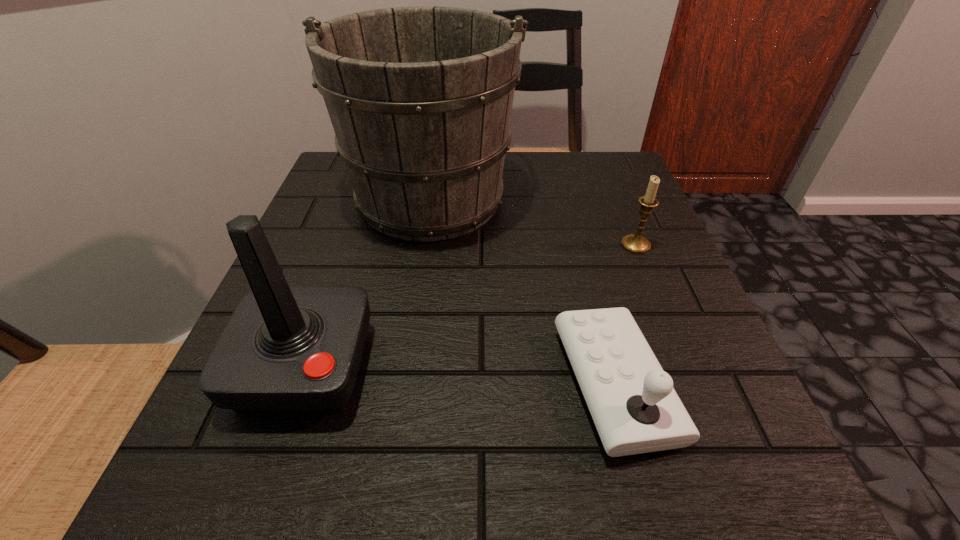
Where is `object that is at the far edge`? Image resolution: width=960 pixels, height=540 pixels. object that is at the far edge is located at coordinates [420, 98].

Where is `object present at the near edge`? object present at the near edge is located at coordinates click(x=631, y=399).

This screenshot has width=960, height=540. What are the coordinates of `bucket that is at the left edge` in the screenshot? It's located at (420, 98).

The image size is (960, 540). Identify the location of joystick positioned at the left edge. (286, 349).

I want to click on candle holder positioned at the right edge, so click(x=638, y=244).

At what (x,y) coordinates should I click in order to perform the action: click on joystick located at the right edge. Please return your answer as a coordinate pair (x, y). The height and width of the screenshot is (540, 960). Looking at the image, I should click on (631, 399).

Locate an element on the screen. The image size is (960, 540). object located in the far left corner section of the desktop is located at coordinates pos(420,98).

I want to click on object present at the near right corner, so click(x=631, y=399).

Locate an element on the screen. This screenshot has width=960, height=540. free space at the far edge of the desktop is located at coordinates (559, 187).

The width and height of the screenshot is (960, 540). I want to click on vacant space at the near edge of the desktop, so click(x=599, y=468).